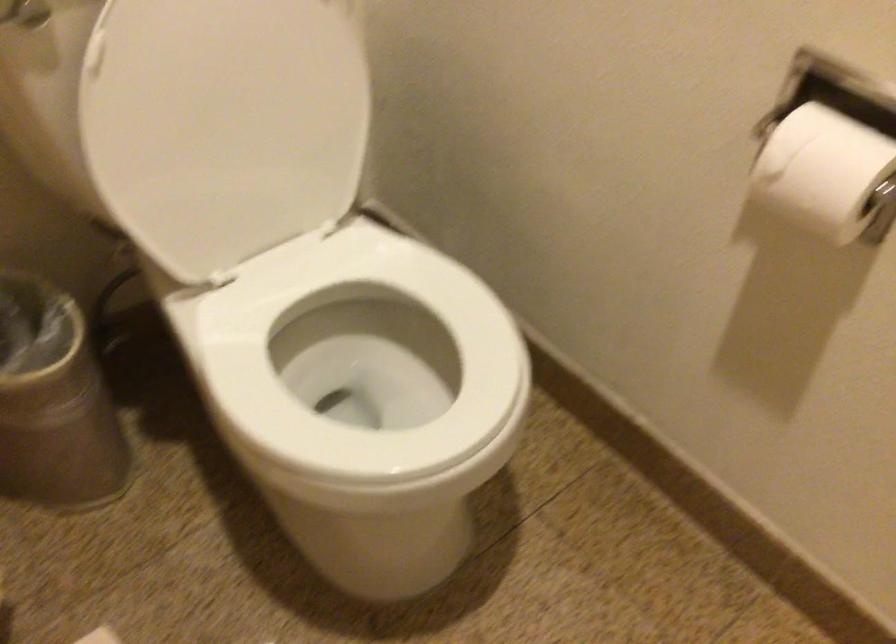
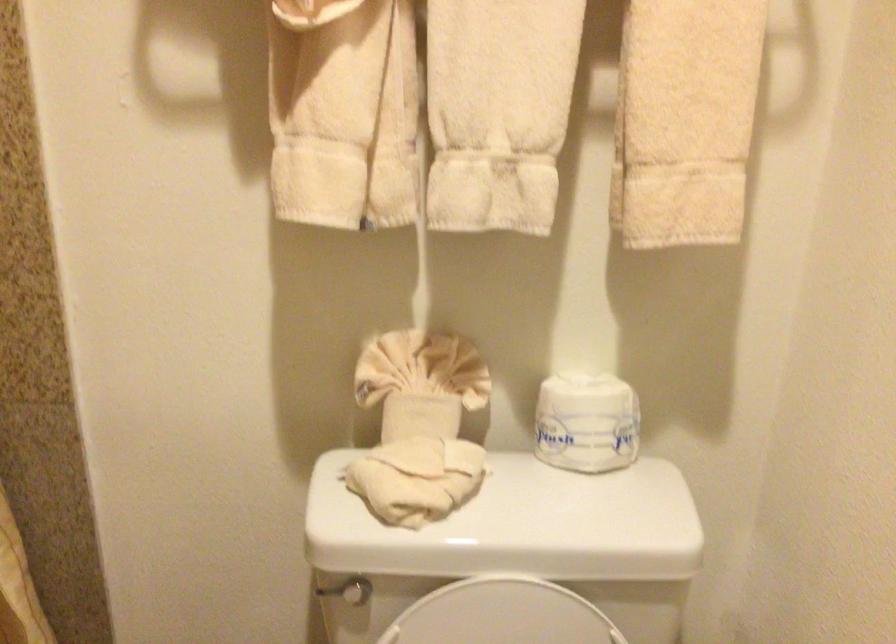
Based on the photo, the images are taken continuously from a first-person perspective. In which direction is your viewpoint rotating?

The camera's rotation is toward left-up.